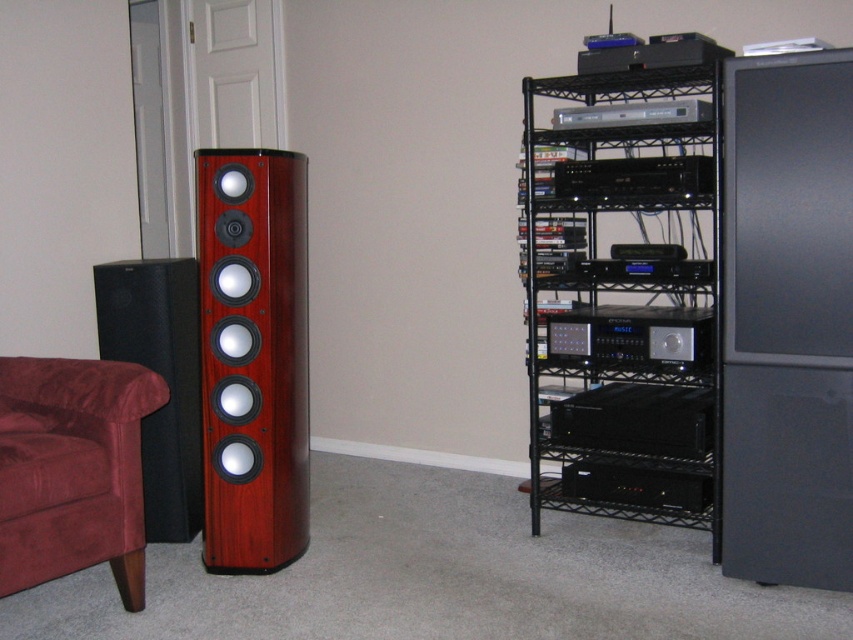
You are setting up a new sound system in the living room. You need to place a new amplifier between the black matte speaker at left and the black plastic stereo at center. Is there enough space to place the amplifier between them?

The black matte speaker at left is to the left of the black plastic stereo at center, so there is space between them to place the amplifier.

You are setting up a new TV stand in the living room and need to move the black plastic stereo at center to the black metal shelving unit at right. Can you move it directly without moving any other objects?

The black metal shelving unit at right is in front of the black plastic stereo at center, so moving the black plastic stereo at center to the black metal shelving unit at right would require moving the shelving unit first or navigating around it since it is blocking the path.

You are setting up a home theater system and need to place the mahogany wood speaker at left and the black matte speaker at left in the living room. According to the image, which speaker should be placed to the right side of the other?

The mahogany wood speaker at left should be placed to the right of the black matte speaker at left as per the image description.